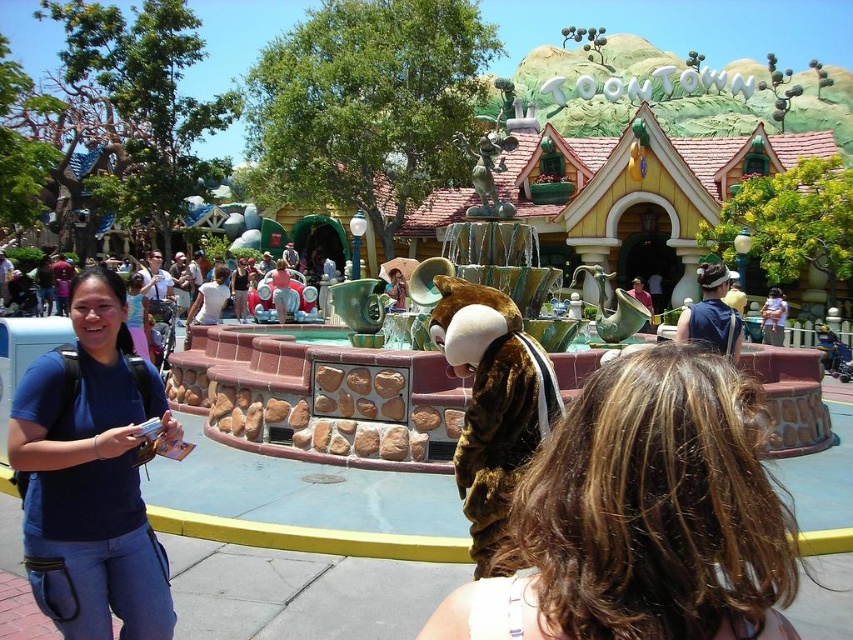
You are standing at the entrance of Toontown in Disneyland and want to reach the point marked at coordinates point [576,588]. Given that you can walk 2 meters per second, how many seconds will it take you to reach that point?

The distance between you and point [576,588] is 19.88 meters. At a walking speed of 2 meters per second, it will take approximately 9.94 seconds to reach the point.